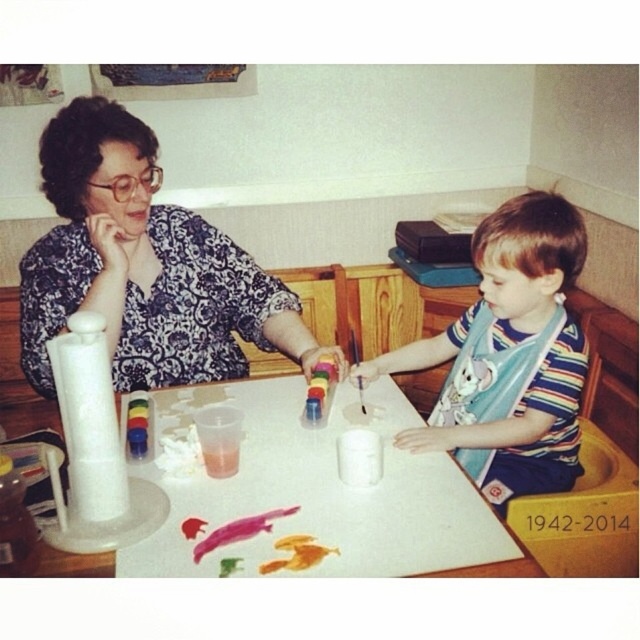
You are standing 2 meters away from a point marked at coordinates point (260, 376). Can you reach that point without moving closer?

The distance of point (260, 376) from viewer is 1.59 meters, so you are currently 2 meters away. Since the point is closer to you than your current position, you can reach it without moving closer.